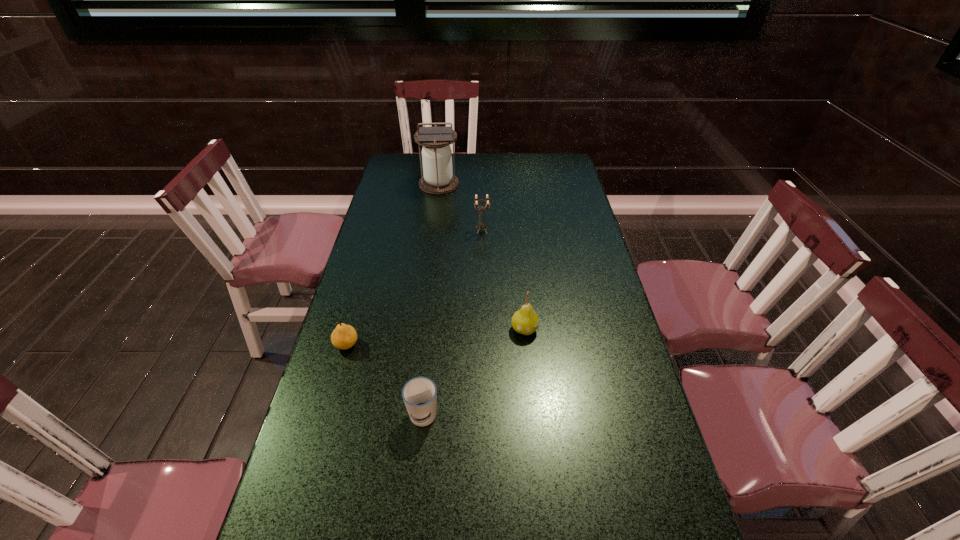
At what (x,y) coordinates should I click in order to perform the action: click on free space located 0.160m on the back of the fourth object from left to right. Please return your answer as a coordinate pair (x, y). This screenshot has width=960, height=540. Looking at the image, I should click on tap(482, 202).

The height and width of the screenshot is (540, 960). What are the coordinates of `free space located 0.110m on the back of the taller pear` in the screenshot? It's located at (520, 292).

You are a GUI agent. You are given a task and a screenshot of the screen. Output one action in this format:
    pyautogui.click(x=<x>, y=<y>)
    Task: Click on the vacant space situated with a handle on the side of the nearest object
    The width and height of the screenshot is (960, 540).
    Given the screenshot: What is the action you would take?
    pyautogui.click(x=410, y=539)

The width and height of the screenshot is (960, 540). I want to click on vacant area situated 0.140m on the front of the left pear, so click(x=330, y=401).

Locate an element on the screen. This screenshot has height=540, width=960. object present at the far edge is located at coordinates (437, 178).

Identify the location of lantern that is at the left edge. (437, 178).

Locate an element on the screen. pear that is at the left edge is located at coordinates (344, 336).

Identify the location of object at the far left corner. This screenshot has width=960, height=540. (437, 178).

Locate an element on the screen. free region at the far edge of the desktop is located at coordinates (522, 166).

The image size is (960, 540). Identify the location of vacant space at the left edge. (333, 454).